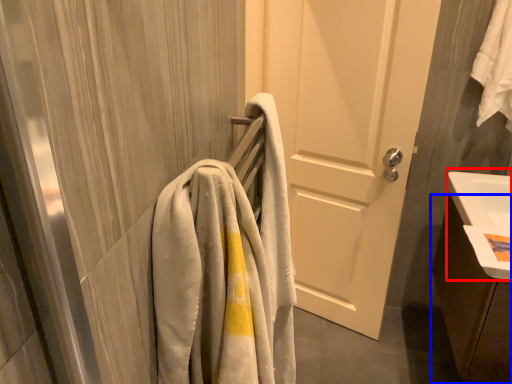
Question: Which object appears farthest to the camera in this image, sink (highlighted by a red box) or bathroom cabinet (highlighted by a blue box)?

Choices:
 (A) sink
 (B) bathroom cabinet

Answer: (B)